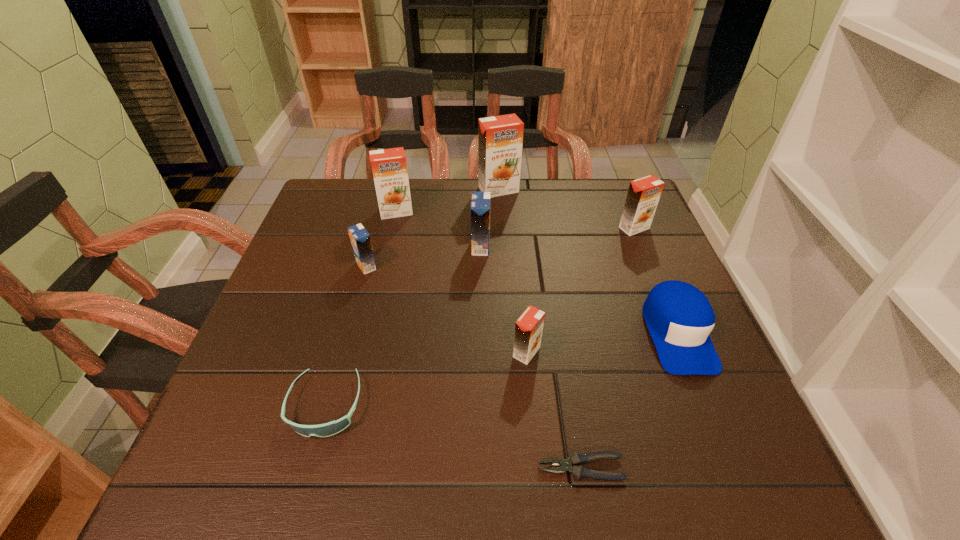
I want to click on blank region between the tallest orange juice and the second farthest orange orange juice, so click(x=447, y=201).

The height and width of the screenshot is (540, 960). What are the coordinates of `object that is the seventh closest one to the goggles` in the screenshot? It's located at (500, 138).

Identify which object is the closest to the rightmost orange orange juice. Please provide its 2D coordinates. Your answer should be formatted as a tuple, i.e. [(x, y)], where the tuple contains the x and y coordinates of a point satisfying the conditions above.

[(679, 317)]

Where is `orange juice that is the third nearest to the farthest orange juice`? This screenshot has width=960, height=540. orange juice that is the third nearest to the farthest orange juice is located at coordinates (643, 195).

Identify which orange juice is located as the fourth nearest to the nearer blue orange_juice. Please provide its 2D coordinates. Your answer should be formatted as a tuple, i.e. [(x, y)], where the tuple contains the x and y coordinates of a point satisfying the conditions above.

[(528, 328)]

This screenshot has width=960, height=540. In order to click on the third closest orange orange juice to the farthest orange orange juice in this screenshot , I will do `click(528, 328)`.

Identify the location of the fourth closest orange orange juice to the farther blue orange_juice. (643, 195).

The width and height of the screenshot is (960, 540). Identify the location of vacant space that satisfies the following two spatial constraints: 1. on the front side of the nearest orange juice; 2. on the left side of the fifth farthest orange juice. (343, 352).